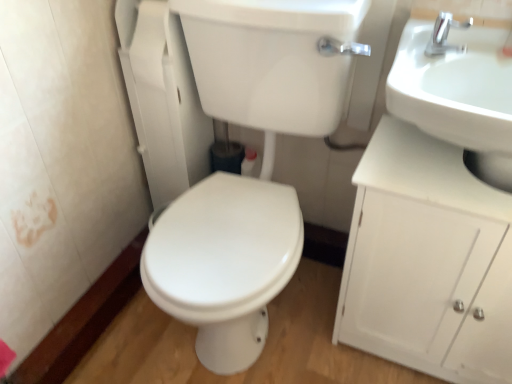
This screenshot has height=384, width=512. In order to click on vacant space in white glossy sink at upper right (from a real-world perspective) in this screenshot , I will do `click(432, 161)`.